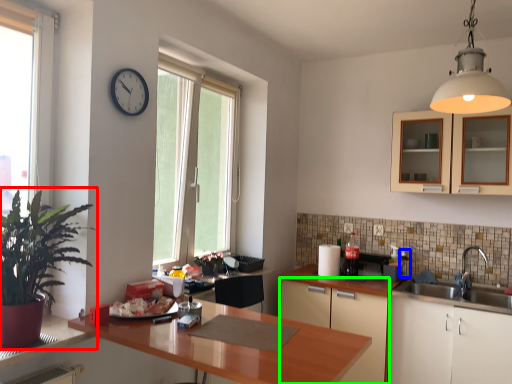
Question: Based on their relative distances, which object is nearer to houseplant (highlighted by a red box)? Choose from appliance (highlighted by a blue box) and cabinetry (highlighted by a green box).

Choices:
 (A) appliance
 (B) cabinetry

Answer: (B)